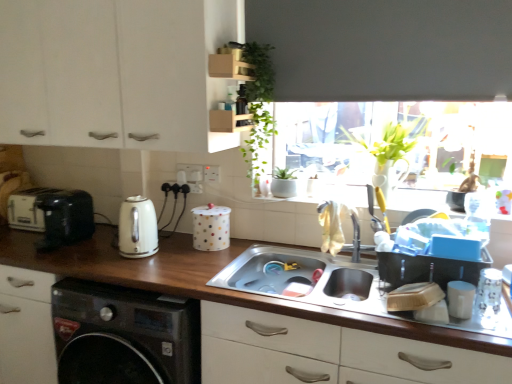
I want to click on vacant area that lies to the right of matte black toaster at left, the third appliance viewed from the right, so click(x=100, y=245).